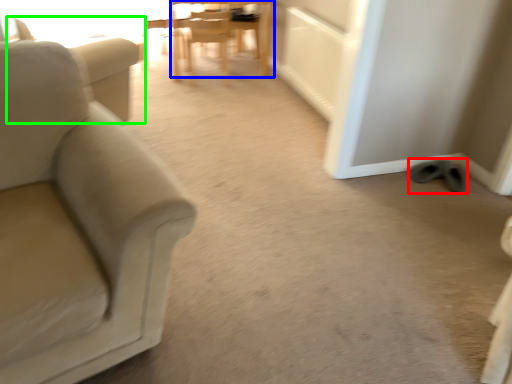
Question: Which object is positioned closest to footwear (highlighted by a red box)? Select from chair (highlighted by a blue box) and swivel chair (highlighted by a green box).

Choices:
 (A) chair
 (B) swivel chair

Answer: (B)